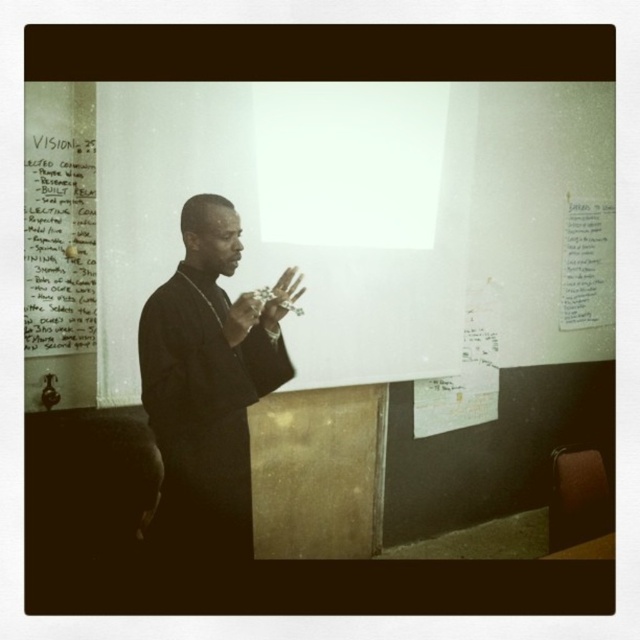
Is white paper at upper left behind white matte hand at center?

Yes, white paper at upper left is further from the viewer.

Is white paper at upper left taller than white matte hand at center?

Indeed, white paper at upper left has a greater height compared to white matte hand at center.

Locate an element on the screen. white paper at upper left is located at coordinates (60, 243).

In the scene shown: Can you confirm if white matte hand at center is smaller than smooth skin hand at center?

No, white matte hand at center is not smaller than smooth skin hand at center.

You are a GUI agent. You are given a task and a screenshot of the screen. Output one action in this format:
    pyautogui.click(x=<x>, y=<y>)
    Task: Click on the white matte hand at center
    
    Given the screenshot: What is the action you would take?
    [x=282, y=296]

Is point (289, 285) closer to viewer compared to point (243, 324)?

No, it is behind (243, 324).

I want to click on white matte hand at center, so click(282, 296).

Does point (196, 336) come closer to viewer compared to point (262, 308)?

Yes, point (196, 336) is closer to viewer.

Is black matte suit at center behind white matte hand at center?

No.

Is point (180, 216) closer to viewer compared to point (289, 298)?

Yes, point (180, 216) is in front of point (289, 298).

Where is `black matte suit at center`? This screenshot has width=640, height=640. black matte suit at center is located at coordinates (204, 387).